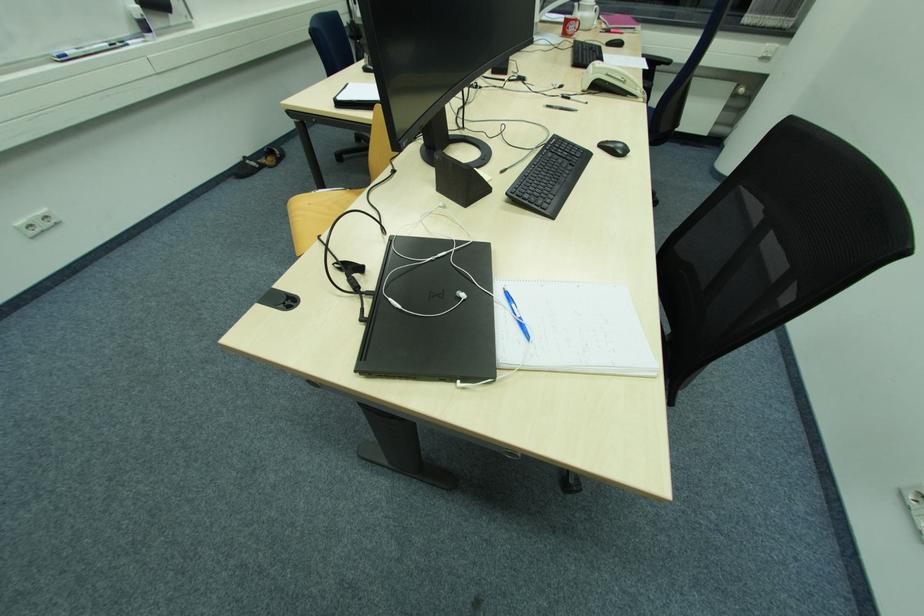
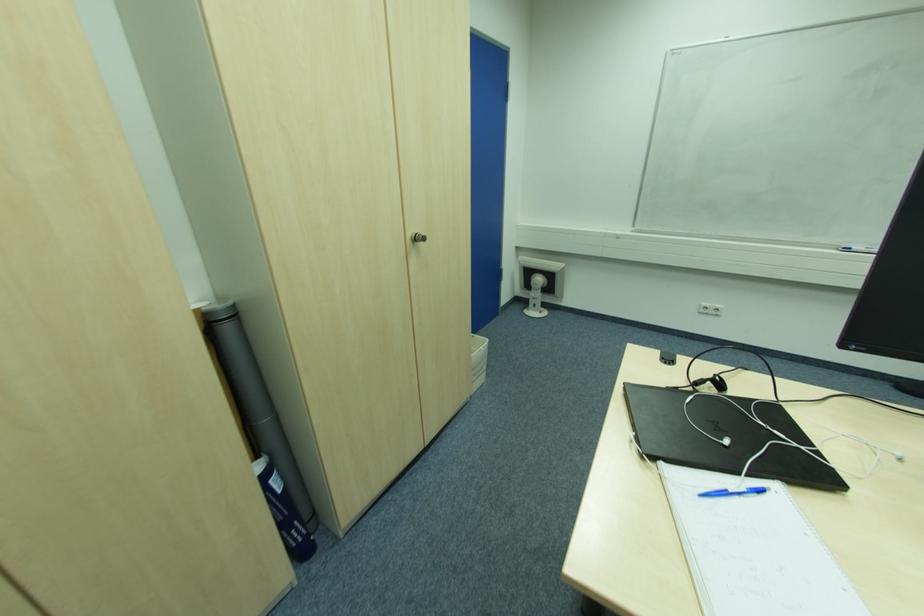
Where in the second image is the point corresponding to point 358,288 from the first image?

(699, 385)